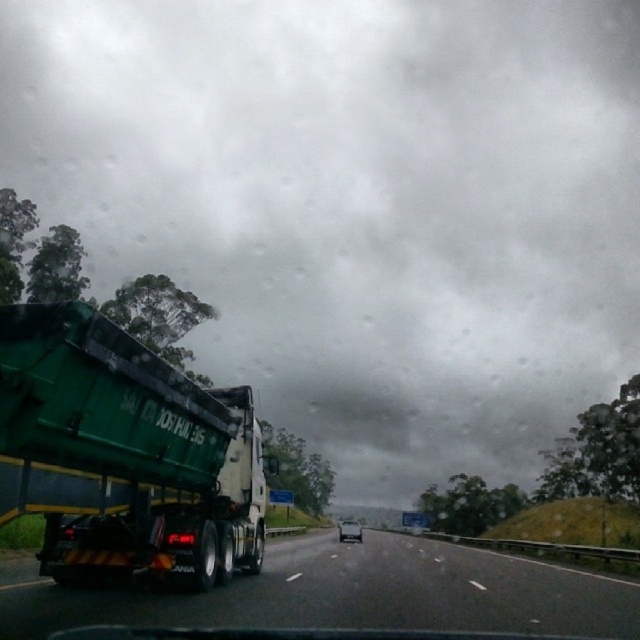
Is green matte truck at left taller than metallic silver sedan at center?

In fact, green matte truck at left may be shorter than metallic silver sedan at center.

Does green matte truck at left appear under metallic silver sedan at center?

Actually, green matte truck at left is above metallic silver sedan at center.

Identify the location of green matte truck at left. The height and width of the screenshot is (640, 640). (124, 452).

Where is `green matte truck at left`? The image size is (640, 640). green matte truck at left is located at coordinates (124, 452).

Based on the photo, does green rubber truck at left have a greater width compared to metallic silver sedan at center?

Correct, the width of green rubber truck at left exceeds that of metallic silver sedan at center.

Identify the location of green rubber truck at left. Image resolution: width=640 pixels, height=640 pixels. (349, 593).

Does green matte truck at left have a lesser width compared to green rubber truck at left?

Correct, green matte truck at left's width is less than green rubber truck at left's.

How far apart are green matte truck at left and green rubber truck at left?

A distance of 21.50 meters exists between green matte truck at left and green rubber truck at left.

Between point (205, 563) and point (388, 573), which one is positioned behind?

The point (388, 573) is more distant.

Where is `green matte truck at left`? green matte truck at left is located at coordinates (124, 452).